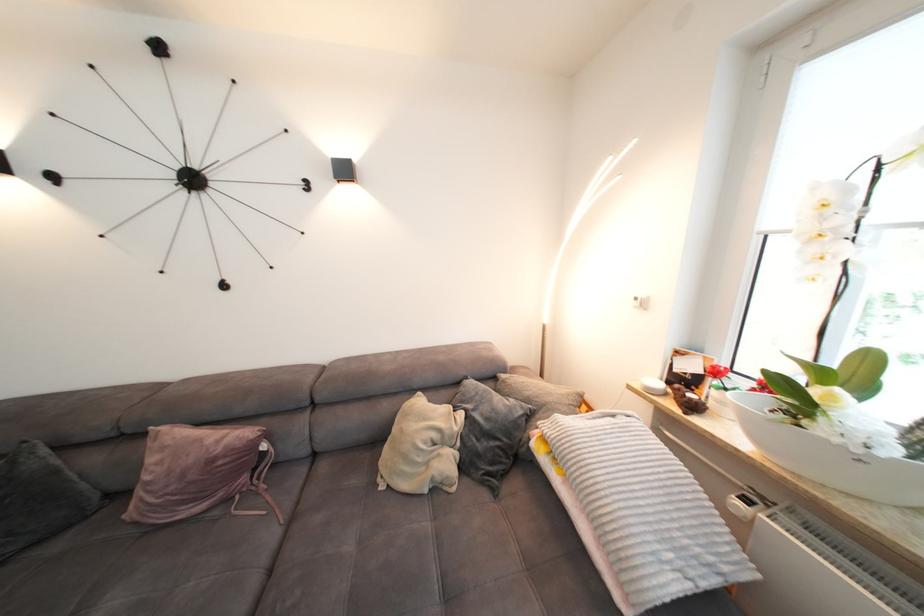
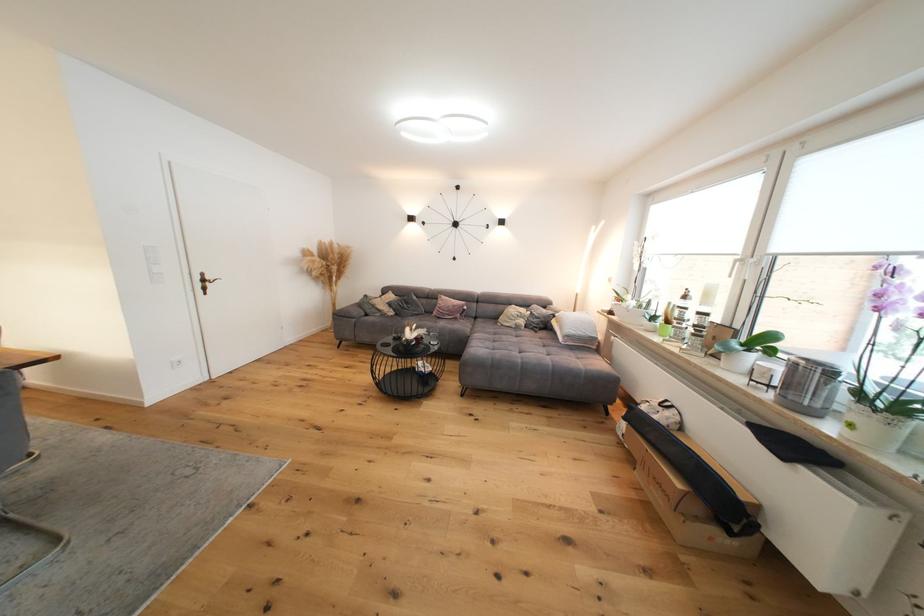
The point at (x=444, y=492) is marked in the first image. Where is the corresponding point in the second image?

(524, 330)